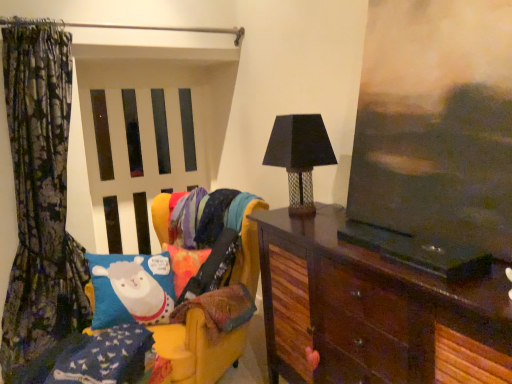
Question: Can you confirm if dark wood cabinet at right is positioned to the right of floral fabric curtain at left?

Choices:
 (A) no
 (B) yes

Answer: (B)

Question: From a real-world perspective, is dark wood cabinet at right on floral fabric curtain at left?

Choices:
 (A) no
 (B) yes

Answer: (A)

Question: Is dark wood cabinet at right looking in the opposite direction of floral fabric curtain at left?

Choices:
 (A) no
 (B) yes

Answer: (A)

Question: Can you confirm if dark wood cabinet at right is wider than floral fabric curtain at left?

Choices:
 (A) no
 (B) yes

Answer: (B)

Question: Is dark wood cabinet at right to the left of floral fabric curtain at left from the viewer's perspective?

Choices:
 (A) yes
 (B) no

Answer: (B)

Question: Is white matte screen door at center in front of or behind floral fabric curtain at left in the image?

Choices:
 (A) front
 (B) behind

Answer: (B)

Question: In terms of width, does white matte screen door at center look wider or thinner when compared to floral fabric curtain at left?

Choices:
 (A) thin
 (B) wide

Answer: (A)

Question: Does point (119, 225) appear closer or farther from the camera than point (6, 99)?

Choices:
 (A) closer
 (B) farther

Answer: (B)

Question: Would you say white matte screen door at center is inside or outside floral fabric curtain at left?

Choices:
 (A) outside
 (B) inside

Answer: (A)

Question: Do you think black mesh table lamp at center right is within dark wood cabinet at right, or outside of it?

Choices:
 (A) inside
 (B) outside

Answer: (B)

Question: From the image's perspective, is black mesh table lamp at center right positioned above or below dark wood cabinet at right?

Choices:
 (A) below
 (B) above

Answer: (B)

Question: Is black mesh table lamp at center right to the left or to the right of dark wood cabinet at right in the image?

Choices:
 (A) right
 (B) left

Answer: (B)

Question: Is black mesh table lamp at center right wider or thinner than dark wood cabinet at right?

Choices:
 (A) wide
 (B) thin

Answer: (B)

Question: Is point (23, 81) positioned closer to the camera than point (173, 329)?

Choices:
 (A) farther
 (B) closer

Answer: (A)

Question: Looking at the image, does floral fabric curtain at left seem bigger or smaller compared to velvet yellow swivel chair at left?

Choices:
 (A) big
 (B) small

Answer: (B)